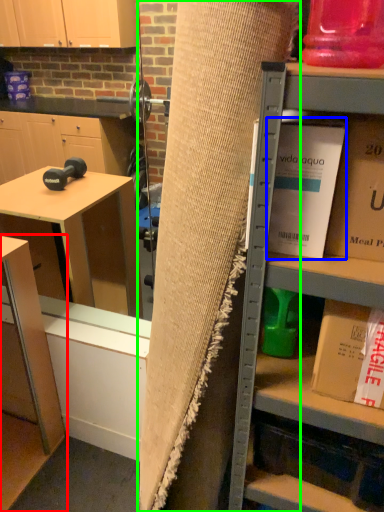
Question: Based on their relative distances, which object is farther from table (highlighted by a red box)? Choose from book (highlighted by a blue box) and curtain (highlighted by a green box).

Choices:
 (A) book
 (B) curtain

Answer: (A)